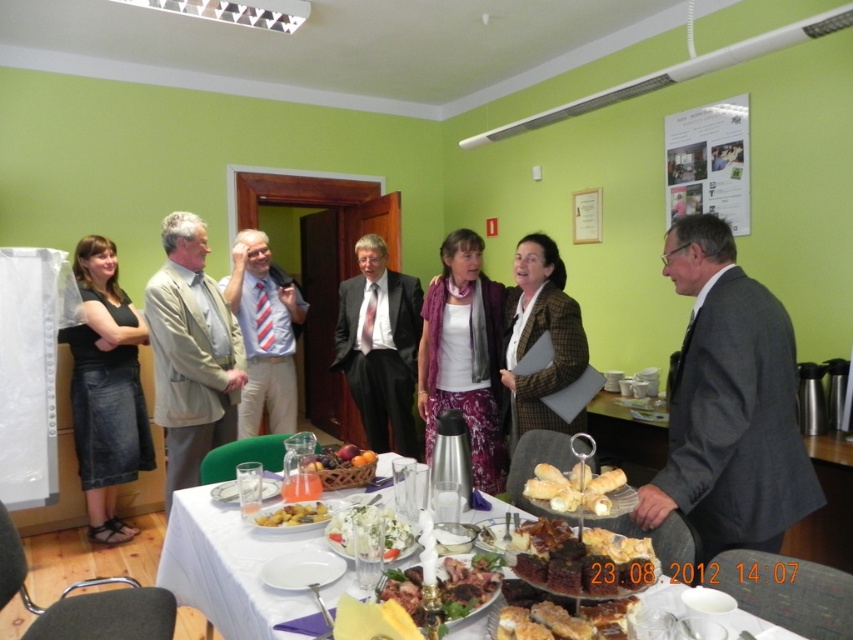
You are at a party and want to grab a slice of chocolate cake at center and a piece of fruit from the fresh fruit basket at center. Which one is located to the right side of the other?

The chocolate cake at center is to the right of the fresh fruit basket at center.

You are a guest at this event and want to place a small gift on the table. The gift requires a flat surface that is taller than the fresh fruit basket at center. Can you use the purple fabric scarf at center for this purpose?

The purple fabric scarf at center is taller than the fresh fruit basket at center, so yes, you can use the purple fabric scarf at center as it meets the height requirement.